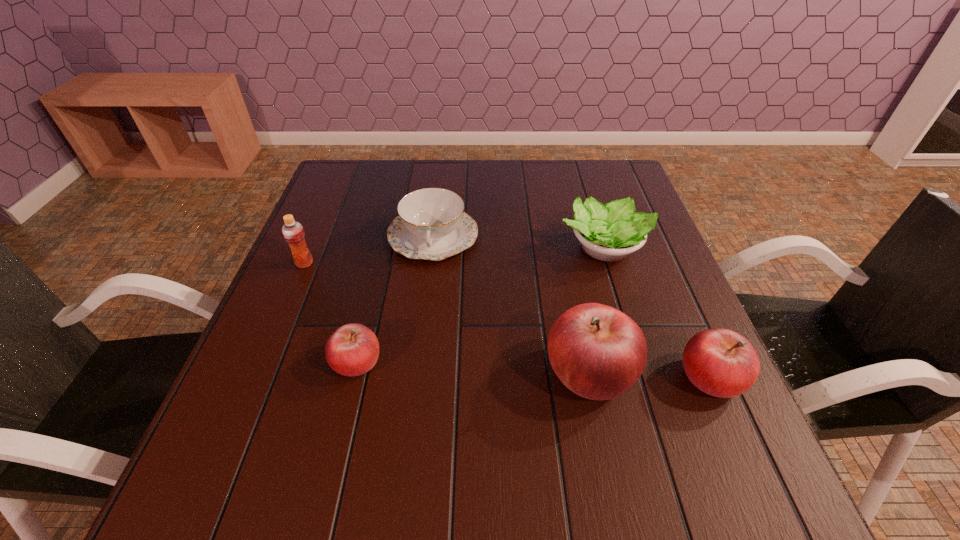
The height and width of the screenshot is (540, 960). Identify the location of the shortest apple. (353, 349).

Find the location of a particular element. The height and width of the screenshot is (540, 960). the second apple from right to left is located at coordinates (598, 352).

In order to click on the second shortest apple in this screenshot , I will do `click(720, 362)`.

In order to click on chinaware in this screenshot , I will do `click(431, 225)`.

The height and width of the screenshot is (540, 960). Identify the location of lettuce. pos(610,232).

The image size is (960, 540). I want to click on the leftmost object, so click(x=293, y=232).

Locate an element on the screen. This screenshot has width=960, height=540. orange juice is located at coordinates (293, 232).

Image resolution: width=960 pixels, height=540 pixels. I want to click on vacant space located 0.290m on the back of the leftmost apple, so [384, 249].

Where is `free space located on the back of the second apple from right to left`? free space located on the back of the second apple from right to left is located at coordinates (567, 265).

You are a GUI agent. You are given a task and a screenshot of the screen. Output one action in this format:
    pyautogui.click(x=<x>, y=<y>)
    Task: Click on the free region located 0.160m on the back of the rightmost apple
    This screenshot has width=960, height=540.
    Given the screenshot: What is the action you would take?
    pyautogui.click(x=674, y=293)